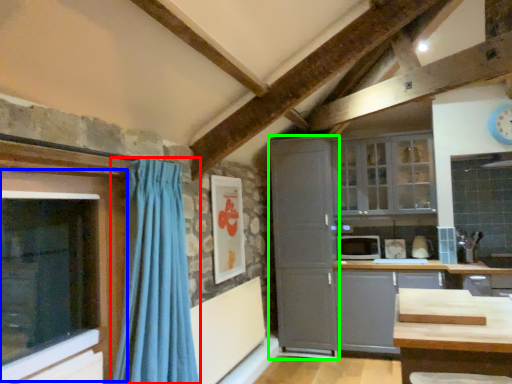
Question: Which object is the closest to the curtain (highlighted by a red box)? Choose among these: window (highlighted by a blue box) or cabinetry (highlighted by a green box).

Choices:
 (A) window
 (B) cabinetry

Answer: (A)